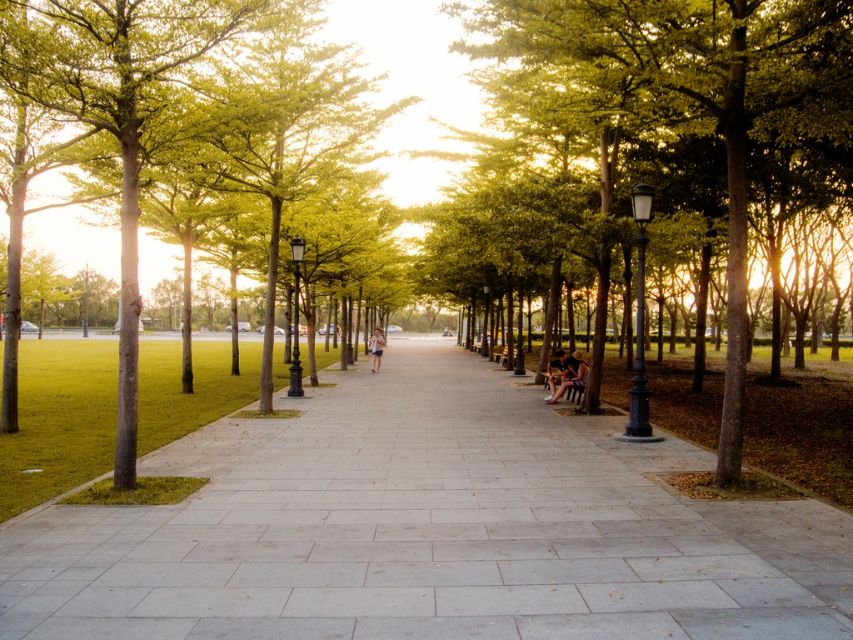
Question: Is gray concrete pavement at center bigger than green leafy tree at center?

Choices:
 (A) no
 (B) yes

Answer: (A)

Question: From the image, what is the correct spatial relationship of gray concrete pavement at center in relation to green leafy tree at center?

Choices:
 (A) left
 (B) right

Answer: (A)

Question: Which point is farther to the camera?

Choices:
 (A) gray concrete pavement at center
 (B) green leafy tree at center

Answer: (B)

Question: Does gray concrete pavement at center appear on the right side of green leafy tree at center?

Choices:
 (A) no
 (B) yes

Answer: (A)

Question: Which object appears closest to the camera in this image?

Choices:
 (A) gray concrete pavement at center
 (B) green leafy tree at center

Answer: (A)